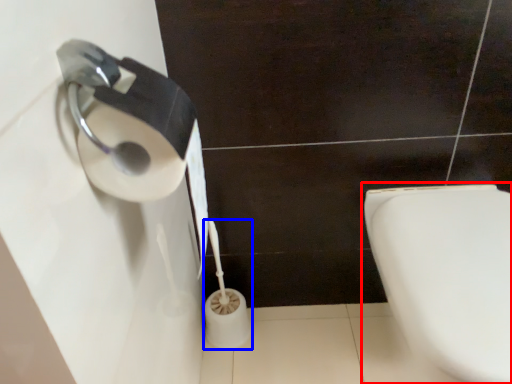
Question: Which of the following is the closest to the observer, toilet (highlighted by a red box) or toilet paper (highlighted by a blue box)?

Choices:
 (A) toilet
 (B) toilet paper

Answer: (A)